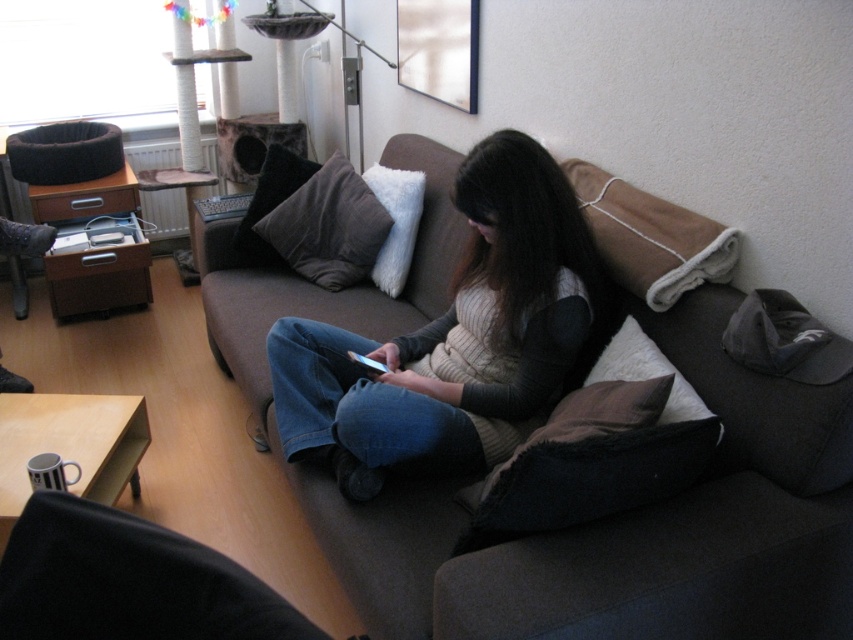
You are organizing a photo shoot and need to position two props correctly. The knit sweater at center and the brown velvet pillow at center must be arranged according to their original positions. Which prop is positioned to the right of the other?

The knit sweater at center is to the right of brown velvet pillow at center.

You are organizing a charity event and need to decide which items to donate. The knit sweater at center and the brown velvet pillow at center are both on the sofa. Based on their sizes, which item would be more suitable to donate if you prioritize donating larger items?

The knit sweater at center is larger in size than the brown velvet pillow at center, so the knit sweater at center would be more suitable to donate if prioritizing larger items.